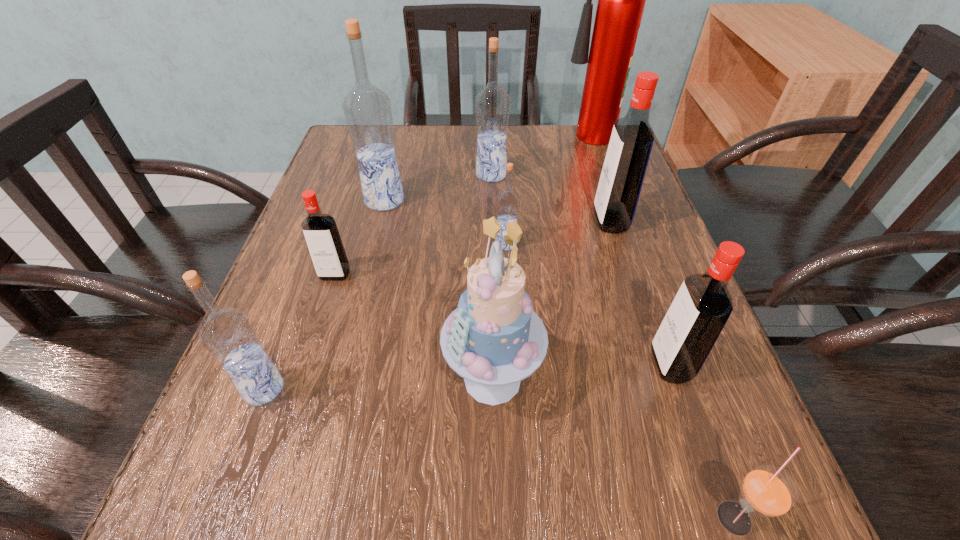
Find the location of a particular element. This screenshot has height=540, width=960. unoccupied position between the nearest red vodka and the fifth farthest object is located at coordinates (588, 304).

At what (x,y) coordinates should I click in order to perform the action: click on vacant space that is in between the biggest red vodka and the nearest blue vodka. Please return your answer as a coordinate pair (x, y). Looking at the image, I should click on (437, 305).

Where is `vacant area that lies between the third biggest blue vodka and the biggest red vodka`? vacant area that lies between the third biggest blue vodka and the biggest red vodka is located at coordinates (437, 305).

Find the location of `free space between the ninth nearest object and the biggest blue vodka`. free space between the ninth nearest object and the biggest blue vodka is located at coordinates (438, 187).

Image resolution: width=960 pixels, height=540 pixels. Find the location of `vacant space that is in between the farthest vodka and the farthest red vodka`. vacant space that is in between the farthest vodka and the farthest red vodka is located at coordinates (551, 198).

Select which object is the ninth closest to the leftmost blue vodka. Please provide its 2D coordinates. Your answer should be formatted as a tuple, i.e. [(x, y)], where the tuple contains the x and y coordinates of a point satisfying the conditions above.

[(621, 0)]

This screenshot has width=960, height=540. What are the coordinates of `object that ranks as the fifth closest to the second nearest red vodka` in the screenshot? It's located at (492, 103).

Locate which vodka is the fourth closest to the smallest red vodka. Please provide its 2D coordinates. Your answer should be formatted as a tuple, i.e. [(x, y)], where the tuple contains the x and y coordinates of a point satisfying the conditions above.

[(492, 103)]

Locate which vodka is the fifth closest to the nearest blue vodka. Please provide its 2D coordinates. Your answer should be formatted as a tuple, i.e. [(x, y)], where the tuple contains the x and y coordinates of a point satisfying the conditions above.

[(492, 103)]

Choose which blue vodka is the fourth nearest neighbor to the second smallest red vodka. Please provide its 2D coordinates. Your answer should be formatted as a tuple, i.e. [(x, y)], where the tuple contains the x and y coordinates of a point satisfying the conditions above.

[(227, 334)]